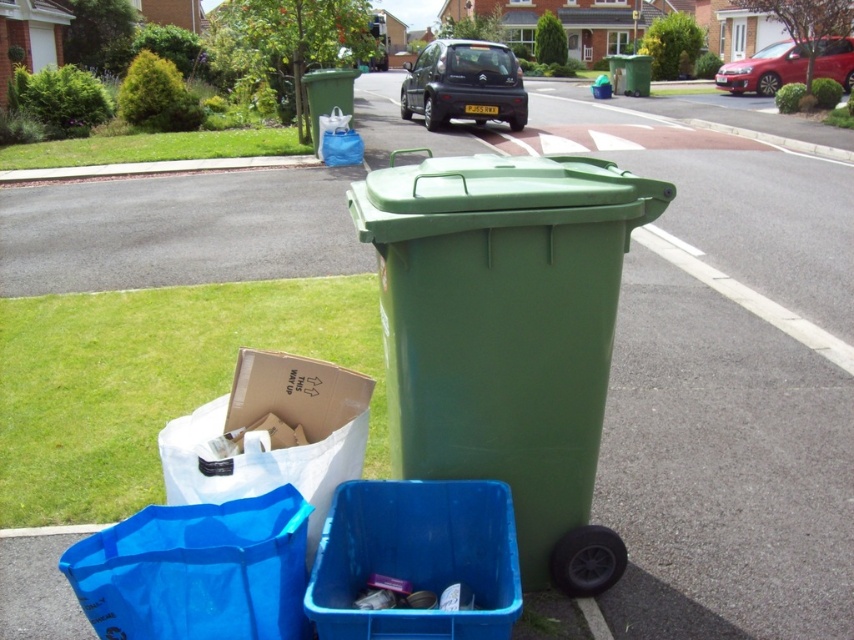
Question: Is green plastic recycling bin at center to the left of blue plastic recycling bin at lower center from the viewer's perspective?

Choices:
 (A) no
 (B) yes

Answer: (A)

Question: Considering the relative positions of matte black car at center and metallic red sedan at upper right in the image provided, where is matte black car at center located with respect to metallic red sedan at upper right?

Choices:
 (A) above
 (B) below

Answer: (A)

Question: Which object is farther from the camera taking this photo?

Choices:
 (A) blue plastic bag at lower left
 (B) green plastic bin at center
 (C) green plastic bin at upper center

Answer: (B)

Question: Can you confirm if matte black car at center is thinner than green plastic bin at upper center?

Choices:
 (A) no
 (B) yes

Answer: (A)

Question: Which point is farther to the camera?

Choices:
 (A) (519, 84)
 (B) (845, 54)
 (C) (338, 500)
 (D) (80, 602)

Answer: (B)

Question: Which of these objects is positioned closest to the green plastic bin at upper center?

Choices:
 (A) green plastic recycling bin at center
 (B) matte black car at center
 (C) blue plastic recycling bin at lower center

Answer: (B)